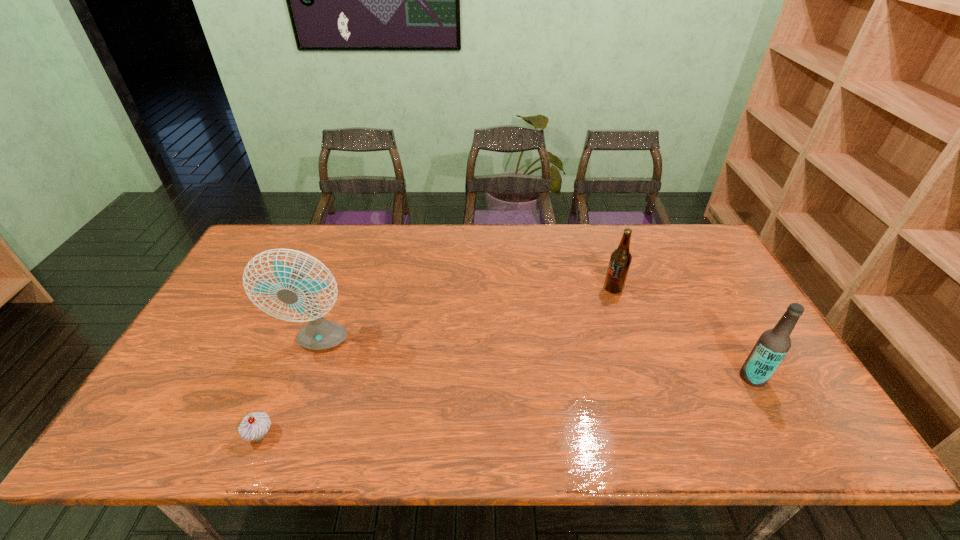
You are a GUI agent. You are given a task and a screenshot of the screen. Output one action in this format:
    pyautogui.click(x=<x>, y=<y>)
    Task: Click on the vacant space located on the side of the rightmost object with the label
    This screenshot has width=960, height=540.
    Given the screenshot: What is the action you would take?
    pyautogui.click(x=680, y=377)

Find the location of `blank space located on the side of the rightmost object with the label`. blank space located on the side of the rightmost object with the label is located at coordinates (688, 377).

The width and height of the screenshot is (960, 540). Find the location of `free space located 0.340m on the label of the farther beer bottle`. free space located 0.340m on the label of the farther beer bottle is located at coordinates click(492, 289).

The width and height of the screenshot is (960, 540). In order to click on free point located 0.160m on the label of the farther beer bottle in this screenshot , I will do `click(552, 289)`.

Image resolution: width=960 pixels, height=540 pixels. In order to click on free space located 0.170m on the label of the farther beer bottle in this screenshot , I will do `click(548, 289)`.

At what (x,y) coordinates should I click in order to perform the action: click on vacant space located on the left of the nearest object. Please return your answer as a coordinate pair (x, y). Looking at the image, I should click on (195, 435).

This screenshot has height=540, width=960. Find the location of `object that is positioned at the near edge`. object that is positioned at the near edge is located at coordinates (255, 426).

You are a GUI agent. You are given a task and a screenshot of the screen. Output one action in this format:
    pyautogui.click(x=<x>, y=<y>)
    Task: Click on the object present at the right edge
    Image resolution: width=960 pixels, height=540 pixels.
    Given the screenshot: What is the action you would take?
    pyautogui.click(x=773, y=344)

Locate an element on the screen. The width and height of the screenshot is (960, 540). vacant area at the far edge of the desktop is located at coordinates (316, 242).

In the image, there is a desktop. Identify the location of vacant space at the near edge. This screenshot has height=540, width=960. (356, 416).